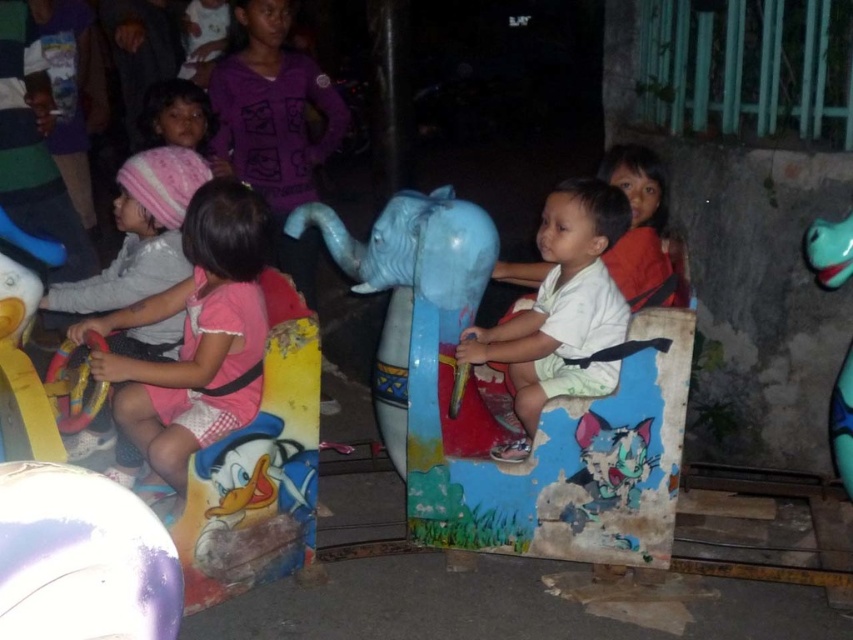
You are a parent trying to locate your child who is playing near two elephants in the center of the playground. According to the scene description, which elephant is positioned lower between the blue matte elephant at center and the white matte elephant at center?

The blue matte elephant at center is positioned below the white matte elephant at center, so the blue one is lower.

Consider the image. You are a parent trying to locate your child who is wearing a pink fabric dress at left and is sitting on a teal rubber elephant at right. Based on the scene description, where would you find the child?

The pink fabric dress at left is above the teal rubber elephant at right, so the child wearing the pink fabric dress at left is positioned higher up than the teal rubber elephant at right. This suggests the child is likely seated on a ride or structure elevated above the teal rubber elephant at right.